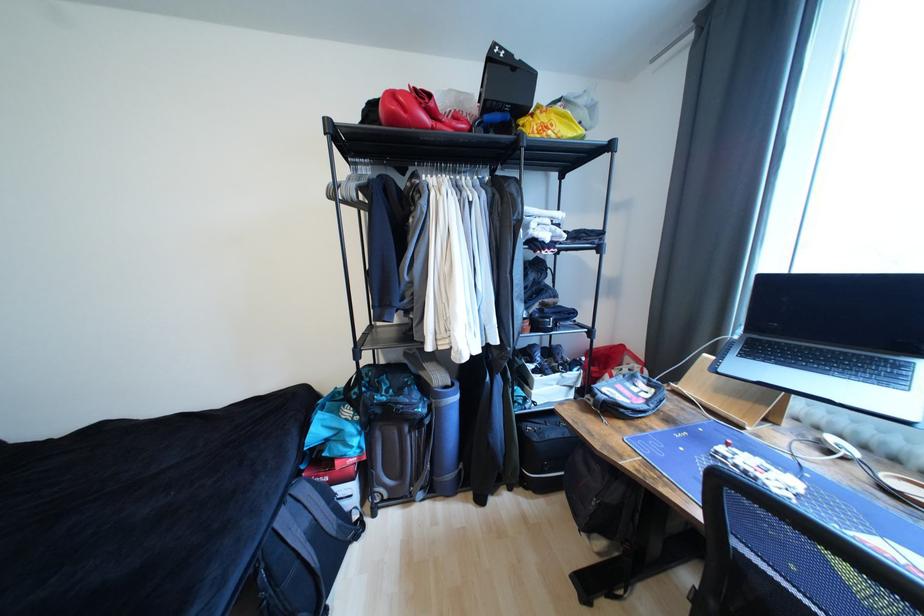
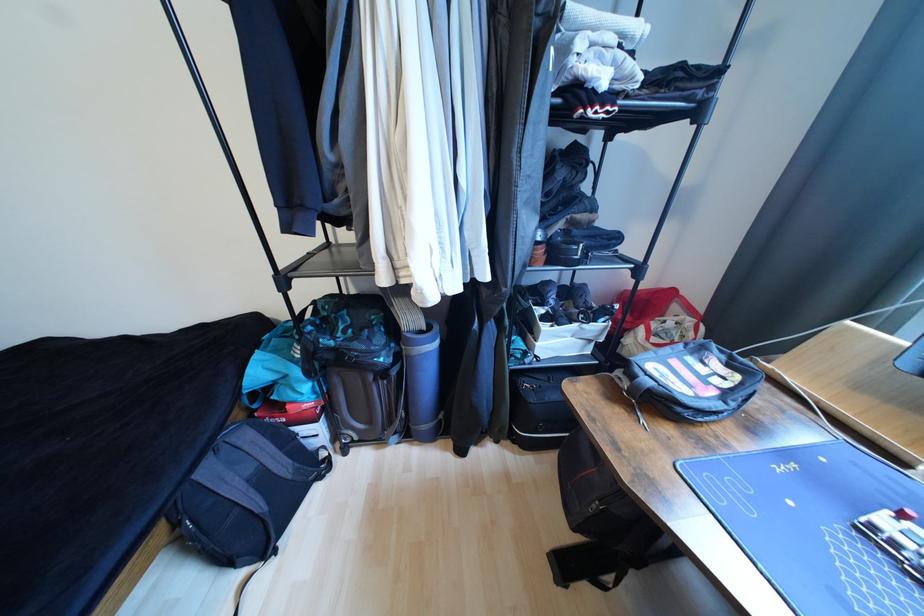
Question: The first image is from the beginning of the video and the second image is from the end. How did the camera likely rotate when shooting the video?

Choices:
 (A) Left
 (B) Right
 (C) Up
 (D) Down

Answer: (D)